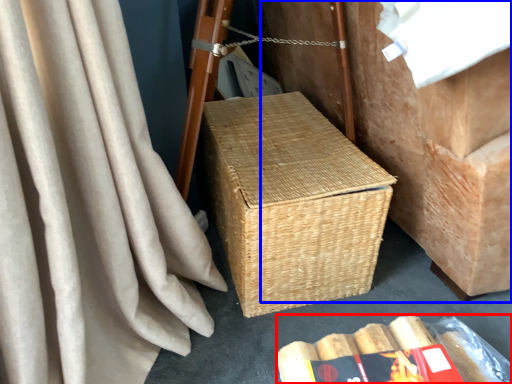
Question: Which object is closer to the camera taking this photo, storage box (highlighted by a red box) or furniture (highlighted by a blue box)?

Choices:
 (A) storage box
 (B) furniture

Answer: (B)